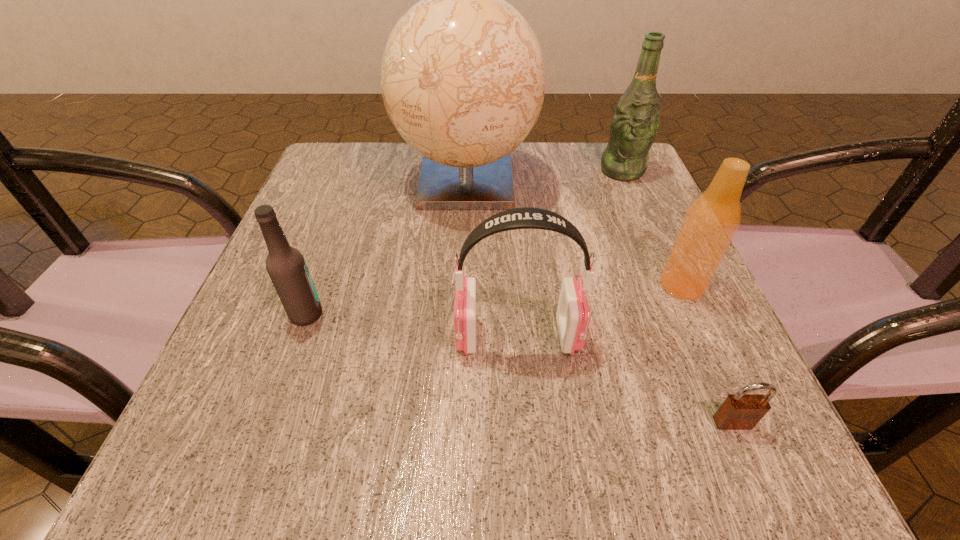
The height and width of the screenshot is (540, 960). I want to click on padlock that is at the right edge, so click(x=740, y=411).

This screenshot has height=540, width=960. What are the coordinates of `object at the far right corner` in the screenshot? It's located at (635, 123).

This screenshot has height=540, width=960. In order to click on object positioned at the near right corner in this screenshot , I will do `click(740, 411)`.

In the image, there is a desktop. Identify the location of vacant space at the far edge. (548, 186).

Identify the location of vacant space at the near edge of the desktop. (413, 461).

Find the location of a particular element. This screenshot has height=540, width=960. vacant space at the left edge of the desktop is located at coordinates (229, 361).

This screenshot has width=960, height=540. I want to click on vacant space at the right edge of the desktop, so click(x=650, y=241).

Find the location of a particular element. This screenshot has width=960, height=540. vacant space at the far left corner of the desktop is located at coordinates (357, 143).

At what (x,y) coordinates should I click in order to perform the action: click on vacant space at the near left corner of the desktop. Please return your answer as a coordinate pair (x, y). This screenshot has height=540, width=960. Looking at the image, I should click on (x=261, y=440).

Image resolution: width=960 pixels, height=540 pixels. In order to click on vacant space at the far right corner of the desktop in this screenshot , I will do `click(597, 192)`.